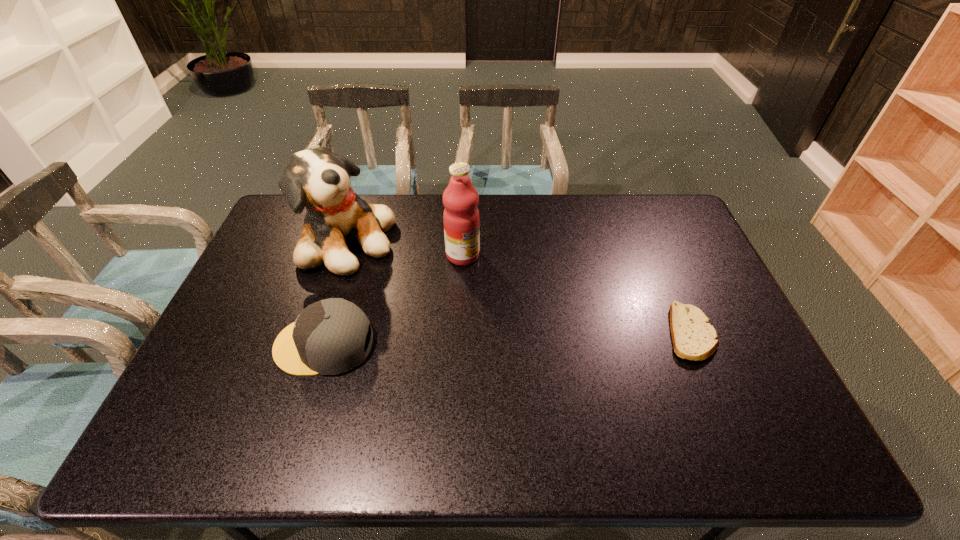
Find the location of a particular element. vacant area situated 0.170m on the label of the third object from left to right is located at coordinates (507, 295).

Locate an element on the screen. This screenshot has width=960, height=540. vacant space located on the label of the third object from left to right is located at coordinates (541, 326).

At what (x,y) coordinates should I click in order to perform the action: click on free region located 0.170m at the face of the puppy. Please return your answer as a coordinate pair (x, y). The height and width of the screenshot is (540, 960). Looking at the image, I should click on 421,283.

Where is `vacant position located at the face of the puppy`? vacant position located at the face of the puppy is located at coordinates (406, 275).

Find the location of a particular element. Image resolution: width=960 pixels, height=540 pixels. blank space located 0.070m at the face of the puppy is located at coordinates (396, 271).

Image resolution: width=960 pixels, height=540 pixels. Find the location of `object positioned at the far edge`. object positioned at the far edge is located at coordinates (316, 178).

Where is `object that is at the left edge`? object that is at the left edge is located at coordinates (316, 178).

Image resolution: width=960 pixels, height=540 pixels. What are the coordinates of `object located at the right edge` in the screenshot? It's located at (694, 338).

Identify the location of object located in the far left corner section of the desktop. The width and height of the screenshot is (960, 540). (316, 178).

You are a GUI agent. You are given a task and a screenshot of the screen. Output one action in this format:
    pyautogui.click(x=<x>, y=<y>)
    Task: Click on the vacant space at the far edge of the desktop
    This screenshot has height=540, width=960.
    Given the screenshot: What is the action you would take?
    pyautogui.click(x=587, y=229)